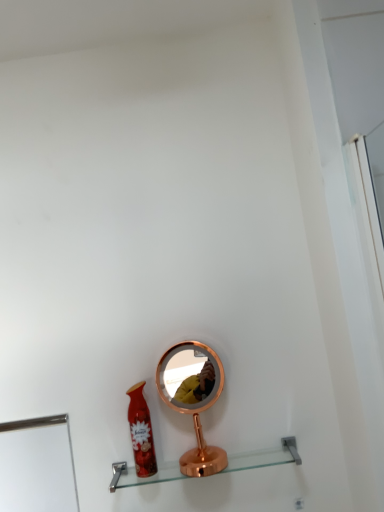
Image resolution: width=384 pixels, height=512 pixels. Describe the element at coordinates (193, 398) in the screenshot. I see `copper metallic mirror at center` at that location.

Where is `matte red spray can at lower center`? matte red spray can at lower center is located at coordinates (141, 432).

Is clear glass shelf at center oriented away from matte red spray can at lower center?

clear glass shelf at center is not turned away from matte red spray can at lower center.

From a real-world perspective, which object rests below the other?

clear glass shelf at center is physically lower.

Does clear glass shelf at center have a greater width compared to matte red spray can at lower center?

Correct, the width of clear glass shelf at center exceeds that of matte red spray can at lower center.

Is clear glass shelf at center positioned with its back to copper metallic mirror at center?

Yes, clear glass shelf at center is positioned with its back facing copper metallic mirror at center.

Can you confirm if clear glass shelf at center is thinner than copper metallic mirror at center?

Yes, clear glass shelf at center is thinner than copper metallic mirror at center.

You are a GUI agent. You are given a task and a screenshot of the screen. Output one action in this format:
    pyautogui.click(x=<x>, y=<y>)
    Task: Click on the mirror behind the clear glass shelf at center
    The height and width of the screenshot is (512, 384).
    Given the screenshot: What is the action you would take?
    pyautogui.click(x=193, y=398)

From a real-world perspective, who is located higher, clear glass shelf at center or copper metallic mirror at center?

From a 3D spatial view, copper metallic mirror at center is above.

From the image's perspective, relative to clear glass shelf at center, is copper metallic mirror at center above or below?

copper metallic mirror at center is above clear glass shelf at center.

Is point (183, 455) less distant than point (290, 462)?

No, it is behind (290, 462).

Is there a large distance between copper metallic mirror at center and clear glass shelf at center?

No, there isn't a large distance between copper metallic mirror at center and clear glass shelf at center.

From a real-world perspective, is copper metallic mirror at center positioned over clear glass shelf at center based on gravity?

Yes.

Considering the sizes of objects matte red spray can at lower center and clear glass shelf at center in the image provided, who is shorter, matte red spray can at lower center or clear glass shelf at center?

clear glass shelf at center is shorter.

Is matte red spray can at lower center oriented towards clear glass shelf at center?

No.

Is matte red spray can at lower center positioned beyond the bounds of clear glass shelf at center?

Yes, matte red spray can at lower center is located beyond the bounds of clear glass shelf at center.

From the image's perspective, which is below, matte red spray can at lower center or clear glass shelf at center?

clear glass shelf at center, from the image's perspective.

From a real-world perspective, which is physically below, matte red spray can at lower center or copper metallic mirror at center?

From a 3D spatial view, matte red spray can at lower center is below.

Is matte red spray can at lower center in front of or behind copper metallic mirror at center in the image?

matte red spray can at lower center is in front of copper metallic mirror at center.

Does point (138, 444) come closer to viewer compared to point (222, 375)?

Yes, point (138, 444) is closer to viewer.

Are matte red spray can at lower center and copper metallic mirror at center making contact?

No, matte red spray can at lower center is not beside copper metallic mirror at center.

Is matte red spray can at lower center inside copper metallic mirror at center?

No, matte red spray can at lower center is located outside of copper metallic mirror at center.

From the image's perspective, is copper metallic mirror at center above or below matte red spray can at lower center?

Clearly, from the image's perspective, copper metallic mirror at center is above matte red spray can at lower center.

Is copper metallic mirror at center turned away from matte red spray can at lower center?

No, copper metallic mirror at center's orientation is not away from matte red spray can at lower center.

From a real-world perspective, is copper metallic mirror at center on top of matte red spray can at lower center?

Yes, from a real-world perspective, copper metallic mirror at center is on top of matte red spray can at lower center.

The height and width of the screenshot is (512, 384). Find the location of `bottle behind the clear glass shelf at center`. bottle behind the clear glass shelf at center is located at coordinates (141, 432).

The height and width of the screenshot is (512, 384). In order to click on mirror above the clear glass shelf at center (from the image's perspective) in this screenshot , I will do `click(193, 398)`.

Estimate the real-world distances between objects in this image. Which object is closer to clear glass shelf at center, matte red spray can at lower center or copper metallic mirror at center?

matte red spray can at lower center is closer to clear glass shelf at center.

Based on their spatial positions, is copper metallic mirror at center or clear glass shelf at center closer to matte red spray can at lower center?

copper metallic mirror at center is closer to matte red spray can at lower center.

When comparing their distances from matte red spray can at lower center, does clear glass shelf at center or copper metallic mirror at center seem closer?

copper metallic mirror at center.

Considering their positions, is copper metallic mirror at center positioned further to clear glass shelf at center than matte red spray can at lower center?

copper metallic mirror at center lies further to clear glass shelf at center than the other object.

From the image, which object appears to be farther from copper metallic mirror at center, clear glass shelf at center or matte red spray can at lower center?

clear glass shelf at center.

Looking at the image, which one is located closer to copper metallic mirror at center, matte red spray can at lower center or clear glass shelf at center?

matte red spray can at lower center.

This screenshot has width=384, height=512. Identify the location of mirror located between matte red spray can at lower center and clear glass shelf at center in the left-right direction. (193, 398).